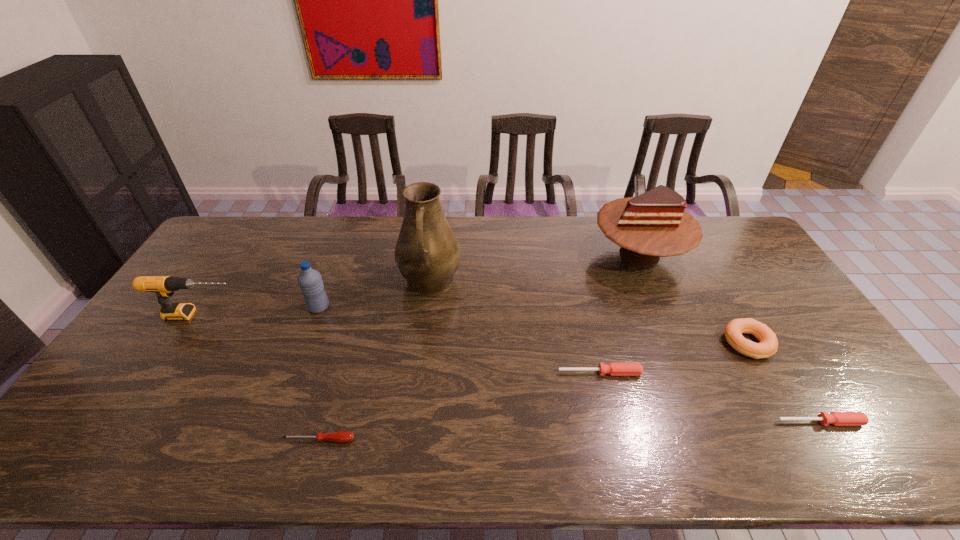
Locate an element on the screen. This screenshot has width=960, height=540. the second farthest screwdriver is located at coordinates (835, 418).

The width and height of the screenshot is (960, 540). Find the location of `the seventh farthest object`. the seventh farthest object is located at coordinates (835, 418).

This screenshot has width=960, height=540. What are the coordinates of `the leftmost screwdriver` in the screenshot? It's located at (341, 436).

At what (x,y) coordinates should I click in order to perform the action: click on the nearest screwdriver. Please return your answer as a coordinate pair (x, y). Looking at the image, I should click on (341, 436).

Find the location of a particular element. vacant space situated on the handle side of the fourth object from left to right is located at coordinates (412, 426).

Locate an element on the screen. The width and height of the screenshot is (960, 540). vacant region located on the left of the cake is located at coordinates (577, 254).

This screenshot has width=960, height=540. I want to click on vacant position located 0.390m on the front of the second object from left to right, so click(272, 433).

Locate an element on the screen. free space located on the handle side of the fourth tallest object is located at coordinates (354, 315).

Image resolution: width=960 pixels, height=540 pixels. I want to click on vacant space situated on the back of the fifth farthest object, so click(719, 293).

Find the location of a particular element. This screenshot has width=960, height=540. vacant space positioned on the right of the second screwdriver from right to left is located at coordinates (671, 373).